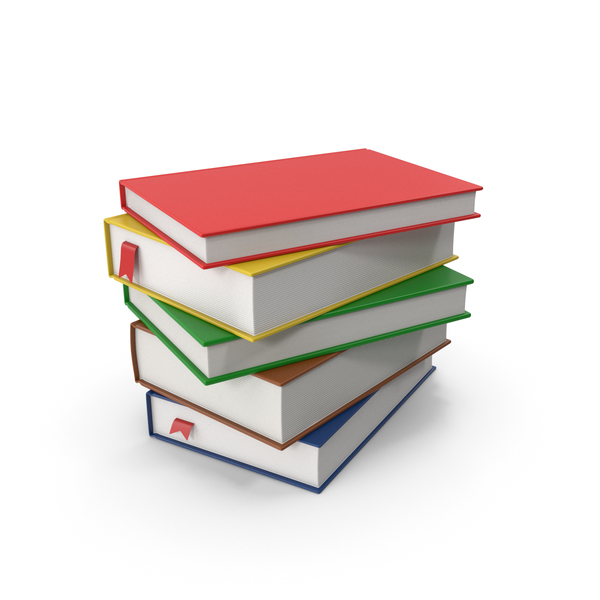
This screenshot has height=600, width=600. What are the coordinates of `book shadows` in the screenshot? It's located at (219, 470), (425, 410).